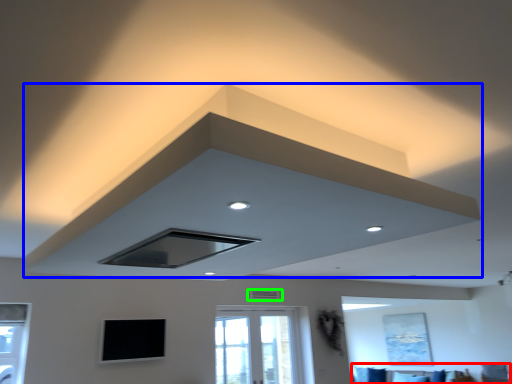
Question: Which object is the closest to the furniture (highlighted by a red box)? Choose among these: exhaust hood (highlighted by a blue box) or air conditioning (highlighted by a green box).

Choices:
 (A) exhaust hood
 (B) air conditioning

Answer: (B)